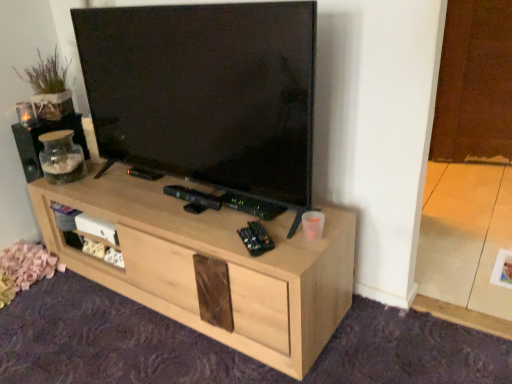
What are the coordinates of `vacant region above natural wood tv stand at center (from a real-world perspective)` in the screenshot? It's located at (175, 192).